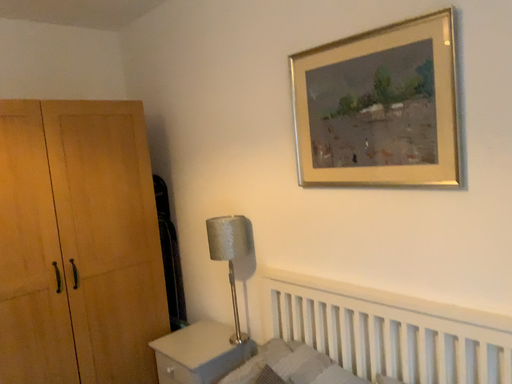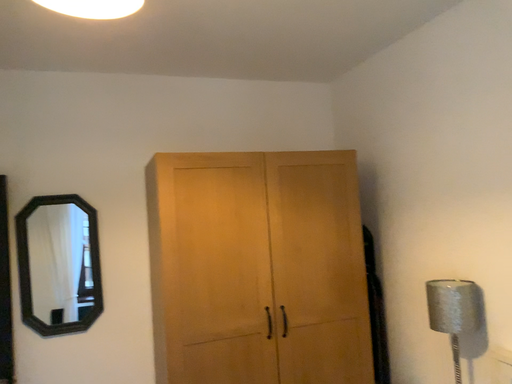
Question: Which way did the camera rotate in the video?

Choices:
 (A) rotated left
 (B) rotated right

Answer: (A)